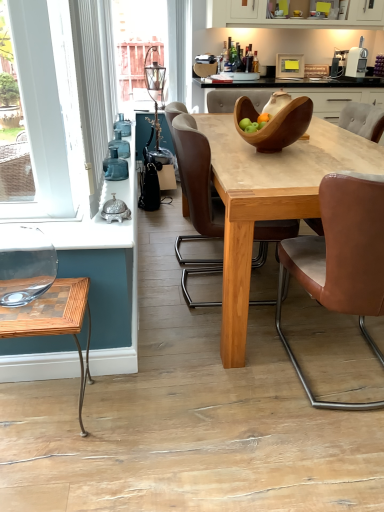
At what (x,y) coordinates should I click in order to perform the action: click on vacant area that lies between wooden checkered coffee table at lower left and brown leather chair at center, which appears as the 2th chair when viewed from the left. Please return your answer as a coordinate pair (x, y). This screenshot has height=512, width=384. Looking at the image, I should click on (202, 402).